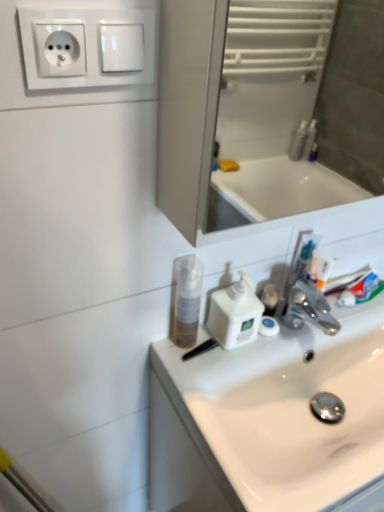
At what (x,y) coordinates should I click in order to perform the action: click on free location in front of translucent plastic mouthwash at sink. Please return your answer as a coordinate pair (x, y). Image resolution: width=384 pixels, height=512 pixels. Looking at the image, I should click on (201, 388).